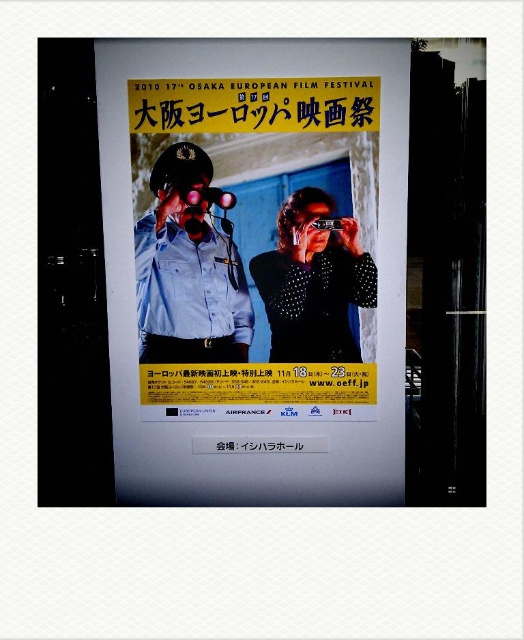
You are organizing a film festival and need to hang the matte paper poster at center and the studded leather jacket at center on a wall. Given their sizes, which one should you place higher to ensure both are visible without overlapping?

The matte paper poster at center has a larger width than the studded leather jacket at center, so you should place the matte paper poster at center higher to accommodate its greater width and ensure visibility without overlapping.

You are standing in front of the poster for the 17th Osaka European Film Festival. You notice two points marked on the poster. The first point is at coordinates point [209,248] and the second point is at point [189,182]. Which of these two points is closer to you?

Point [189,182] is closer to you because it is less further to the camera than point [209,248].

You are a film enthusiast looking at the Osaka European Film Festival poster. You notice two points marked on the poster. The first point is at coordinates point (329,276) and the second is at point (195,195). Which point is closer to the bottom edge of the poster?

Point (195,195) is closer to the bottom edge of the poster because it has a lower y coordinate value than point (329,276).